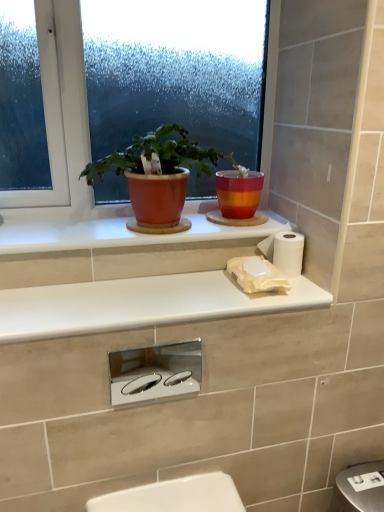
At what (x,y) coordinates should I click in order to perform the action: click on white matte toilet paper at right. Please return your answer as a coordinate pair (x, y). This screenshot has width=384, height=512. Looking at the image, I should click on (284, 251).

The image size is (384, 512). What do you see at coordinates (157, 173) in the screenshot? I see `matte orange pot at upper center` at bounding box center [157, 173].

This screenshot has height=512, width=384. Find the location of `white ceramic window sill at upper center, the first window sill when ordered from top to bottom`. white ceramic window sill at upper center, the first window sill when ordered from top to bottom is located at coordinates (123, 233).

The height and width of the screenshot is (512, 384). What do you see at coordinates (61, 121) in the screenshot?
I see `matte glass window at upper center` at bounding box center [61, 121].

Locate an element on the screen. chrome/polished flush plate at center is located at coordinates (155, 372).

Where is `white glossy countertop at upper center, marked as the 2th window sill in a top-to-bottom arrangement`? This screenshot has height=512, width=384. white glossy countertop at upper center, marked as the 2th window sill in a top-to-bottom arrangement is located at coordinates (141, 304).

In order to face white glossy countertop at upper center, which is the first window sill in bottom-to-top order, should I rotate leftwards or rightwards?

Rotate your view left by about 3.695°.

The image size is (384, 512). Identify the location of white matte toilet paper at right. (284, 251).

Which is more to the right, white matte toilet paper at right or matte orange pot at upper center?

Positioned to the right is white matte toilet paper at right.

How much distance is there between white matte toilet paper at right and matte orange pot at upper center?

white matte toilet paper at right is 13.64 inches from matte orange pot at upper center.

Who is shorter, white matte toilet paper at right or matte orange pot at upper center?

white matte toilet paper at right is shorter.

From a real-world perspective, which object rests below the other?

white matte toilet paper at right is physically lower.

How many degrees apart are the facing directions of white glossy countertop at upper center, marked as the 2th window sill in a top-to-bottom arrangement, and white matte toilet paper at right?

There is a 1.31-degree angle between the facing directions of white glossy countertop at upper center, marked as the 2th window sill in a top-to-bottom arrangement, and white matte toilet paper at right.

In terms of height, does white glossy countertop at upper center, marked as the 2th window sill in a top-to-bottom arrangement, look taller or shorter compared to white matte toilet paper at right?

In the image, white glossy countertop at upper center, marked as the 2th window sill in a top-to-bottom arrangement, appears to be shorter than white matte toilet paper at right.

Looking at their sizes, would you say white glossy countertop at upper center, which is the first window sill in bottom-to-top order, is wider or thinner than white matte toilet paper at right?

Considering their sizes, white glossy countertop at upper center, which is the first window sill in bottom-to-top order, looks broader than white matte toilet paper at right.

From a real-world perspective, is white glossy countertop at upper center, marked as the 2th window sill in a top-to-bottom arrangement, below white matte toilet paper at right?

Correct, in the physical world, white glossy countertop at upper center, marked as the 2th window sill in a top-to-bottom arrangement, is lower than white matte toilet paper at right.

In the image, is matte orange pot at upper center on the left side or the right side of white matte toilet paper at right?

In the image, matte orange pot at upper center appears on the left side of white matte toilet paper at right.

At what (x,y) coordinates should I click in order to perform the action: click on houseplant above the white matte toilet paper at right (from the image's perspective). Please return your answer as a coordinate pair (x, y). Image resolution: width=384 pixels, height=512 pixels. Looking at the image, I should click on (157, 173).

Do you think matte orange pot at upper center is within white matte toilet paper at right, or outside of it?

matte orange pot at upper center is not enclosed by white matte toilet paper at right.

From the image's perspective, who appears lower, chrome/polished flush plate at center or white matte toilet paper at right?

chrome/polished flush plate at center, from the image's perspective.

In the scene shown: Considering the positions of objects chrome/polished flush plate at center and white matte toilet paper at right in the image provided, who is in front, chrome/polished flush plate at center or white matte toilet paper at right?

chrome/polished flush plate at center is closer to the camera.

Between chrome/polished flush plate at center and white matte toilet paper at right, which one has larger width?

With larger width is white matte toilet paper at right.

From the image's perspective, is white matte toilet paper at right positioned above or below matte glass window at upper center?

white matte toilet paper at right is situated lower than matte glass window at upper center in the image.

Is white matte toilet paper at right situated inside matte glass window at upper center or outside?

white matte toilet paper at right is not enclosed by matte glass window at upper center.

Based on their sizes in the image, would you say white matte toilet paper at right is bigger or smaller than matte glass window at upper center?

white matte toilet paper at right is smaller than matte glass window at upper center.

Identify the location of toilet paper below the matte glass window at upper center (from a real-world perspective). (284, 251).

Is point (195, 273) more distant than point (177, 159)?

Yes.

Would you say white glossy countertop at upper center, marked as the 2th window sill in a top-to-bottom arrangement, is outside matte orange pot at upper center?

Yes.

Is white glossy countertop at upper center, marked as the 2th window sill in a top-to-bottom arrangement, positioned with its back to matte orange pot at upper center?

white glossy countertop at upper center, marked as the 2th window sill in a top-to-bottom arrangement, does not have its back to matte orange pot at upper center.

In the scene shown: Which object is positioned more to the right, white glossy countertop at upper center, marked as the 2th window sill in a top-to-bottom arrangement, or matte orange pot at upper center?

white glossy countertop at upper center, marked as the 2th window sill in a top-to-bottom arrangement.

From a real-world perspective, who is located higher, matte orange pot at upper center or chrome/polished flush plate at center?

From a 3D spatial view, matte orange pot at upper center is above.

Is matte orange pot at upper center positioned with its back to chrome/polished flush plate at center?

matte orange pot at upper center is not turned away from chrome/polished flush plate at center.

Based on their positions, is matte orange pot at upper center located to the left or right of chrome/polished flush plate at center?

matte orange pot at upper center is positioned on chrome/polished flush plate at center's left side.

Where is `houseplant that appears in front of the white matte toilet paper at right`? houseplant that appears in front of the white matte toilet paper at right is located at coordinates (157, 173).

Identify the location of toilet paper above the white glossy countertop at upper center, marked as the 2th window sill in a top-to-bottom arrangement (from a real-world perspective). (284, 251).

From the picture: Considering their positions, is chrome/polished flush plate at center positioned further to matte orange pot at upper center than white glossy countertop at upper center, which is the first window sill in bottom-to-top order?

The object further to matte orange pot at upper center is chrome/polished flush plate at center.

Which object lies nearer to the anchor point white ceramic window sill at upper center, the first window sill when ordered from top to bottom, white matte toilet paper at right or matte glass window at upper center?

Among the two, matte glass window at upper center is located nearer to white ceramic window sill at upper center, the first window sill when ordered from top to bottom.

Considering their positions, is white matte toilet paper at right positioned further to matte orange pot at upper center than white glossy countertop at upper center, marked as the 2th window sill in a top-to-bottom arrangement?

white matte toilet paper at right lies further to matte orange pot at upper center than the other object.

Which object lies nearer to the anchor point white matte toilet paper at right, white ceramic window sill at upper center, which ranks as the 2th window sill in bottom-to-top order, or white glossy countertop at upper center, which is the first window sill in bottom-to-top order?

Based on the image, white ceramic window sill at upper center, which ranks as the 2th window sill in bottom-to-top order, appears to be nearer to white matte toilet paper at right.

Which object lies nearer to the anchor point white matte toilet paper at right, chrome/polished flush plate at center or matte glass window at upper center?

chrome/polished flush plate at center lies closer to white matte toilet paper at right than the other object.

When comparing their distances from white glossy countertop at upper center, which is the first window sill in bottom-to-top order, does white matte toilet paper at right or matte orange pot at upper center seem closer?

matte orange pot at upper center is closer to white glossy countertop at upper center, which is the first window sill in bottom-to-top order.

From the image, which object appears to be farther from matte glass window at upper center, chrome/polished flush plate at center or white ceramic window sill at upper center, which ranks as the 2th window sill in bottom-to-top order?

The object further to matte glass window at upper center is chrome/polished flush plate at center.

From the image, which object appears to be nearer to chrome/polished flush plate at center, matte orange pot at upper center or white ceramic window sill at upper center, which ranks as the 2th window sill in bottom-to-top order?

The object closer to chrome/polished flush plate at center is white ceramic window sill at upper center, which ranks as the 2th window sill in bottom-to-top order.

Image resolution: width=384 pixels, height=512 pixels. I want to click on appliance located between white ceramic window sill at upper center, which ranks as the 2th window sill in bottom-to-top order, and white matte toilet paper at right in the left-right direction, so click(155, 372).

I want to click on houseplant between white ceramic window sill at upper center, which ranks as the 2th window sill in bottom-to-top order, and white matte toilet paper at right, in the horizontal direction, so click(157, 173).

Where is `window sill between matte glass window at upper center and white glossy countertop at upper center, marked as the 2th window sill in a top-to-bottom arrangement, in the up-down direction`? The height and width of the screenshot is (512, 384). window sill between matte glass window at upper center and white glossy countertop at upper center, marked as the 2th window sill in a top-to-bottom arrangement, in the up-down direction is located at coordinates (123, 233).

The image size is (384, 512). What are the coordinates of `window sill between matte orange pot at upper center and white matte toilet paper at right` in the screenshot? It's located at (141, 304).